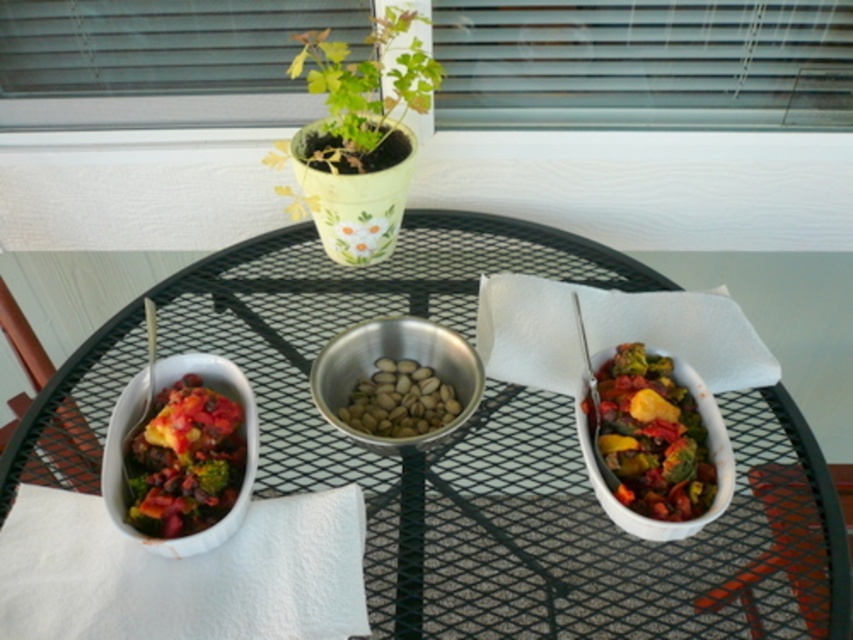
You are a delivery person who needs to place a large package on the metallic mesh table at center. The package is as wide as the table itself. However, there is a green matte plant at upper center on the table. Can the package be placed on the table without moving the plant?

The metallic mesh table at center might be wider than the green matte plant at upper center, so there might be enough space to place the package on the table without moving the plant, but it depends on the exact dimensions.

You are a guest at a dinner party and see the metallic mesh table at center and the white matte bowl at right. Which object is positioned further to the right side of the table?

The white matte bowl at right is positioned further to the right side of the table than the metallic mesh table at center.